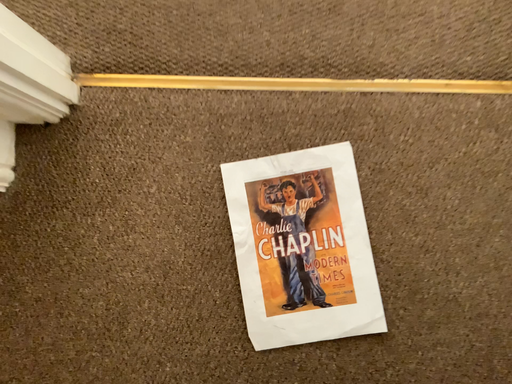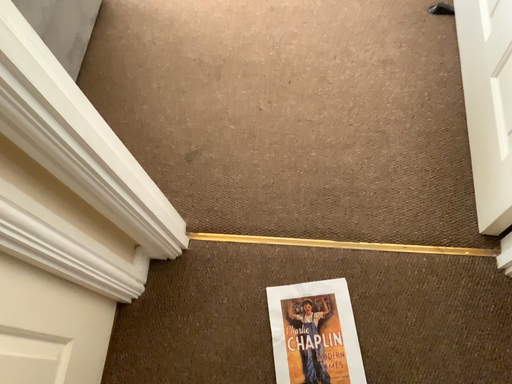
Question: Which way did the camera rotate in the video?

Choices:
 (A) rotated upward
 (B) rotated downward

Answer: (A)